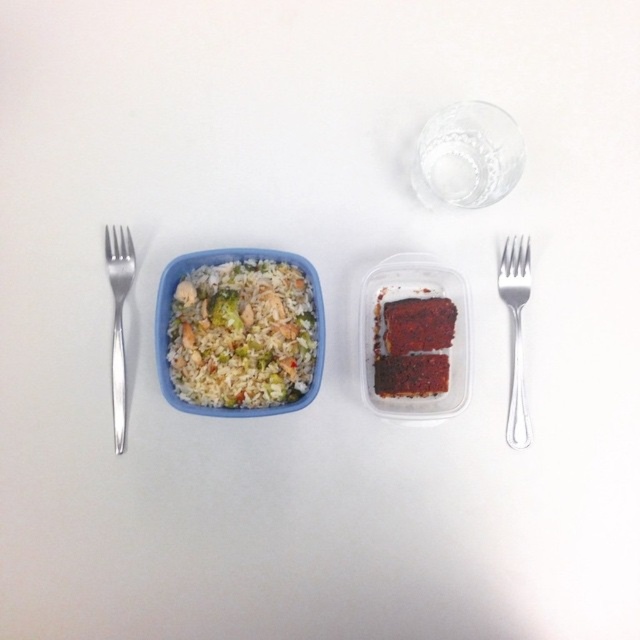
Question: Which point appears farthest from the camera in this image?

Choices:
 (A) (406, 321)
 (B) (509, 310)

Answer: (B)

Question: Does white matte rice at center have a greater width compared to green matte broccoli at center-left?

Choices:
 (A) no
 (B) yes

Answer: (B)

Question: Does white matte rice at center appear over silver metallic fork at left?

Choices:
 (A) no
 (B) yes

Answer: (B)

Question: Which point is farther to the camera?

Choices:
 (A) silver metallic fork at right
 (B) green matte broccoli at center-left
 (C) silver metallic fork at left

Answer: (A)

Question: Which point is farther to the camera?

Choices:
 (A) pyautogui.click(x=515, y=310)
 (B) pyautogui.click(x=280, y=253)

Answer: (A)

Question: Does white matte rice at center have a greater width compared to silver metallic fork at right?

Choices:
 (A) yes
 (B) no

Answer: (A)